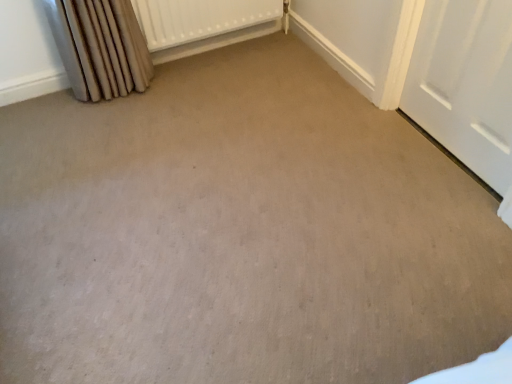
You are a GUI agent. You are given a task and a screenshot of the screen. Output one action in this format:
    pyautogui.click(x=<x>, y=<y>)
    Task: Click on the vacant space that is in between white matte door at right and beige fabric curtain at left
    The width and height of the screenshot is (512, 384).
    Given the screenshot: What is the action you would take?
    pyautogui.click(x=279, y=116)